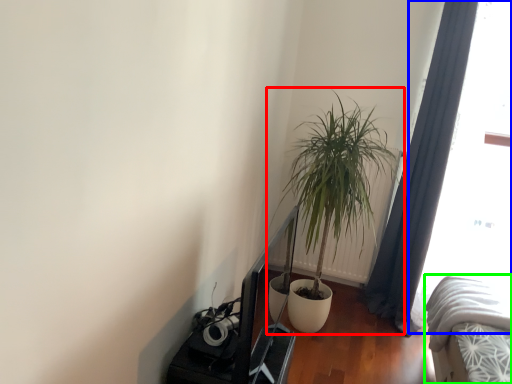
Question: Estimate the real-world distances between objects in this image. Which object is closer to houseplant (highlighted by a red box), window screen (highlighted by a blue box) or bed (highlighted by a green box)?

Choices:
 (A) window screen
 (B) bed

Answer: (A)